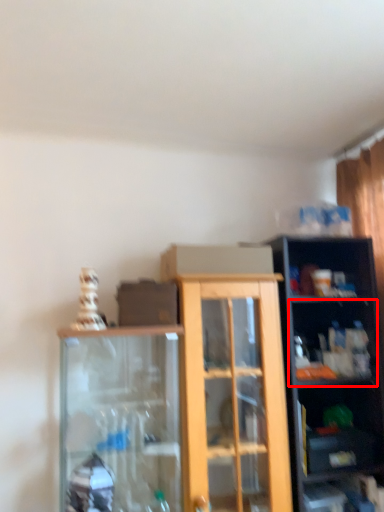
Question: From the image's perspective, where is shelf (annotated by the red box) located in relation to shelf in the image?

Choices:
 (A) above
 (B) below

Answer: (A)